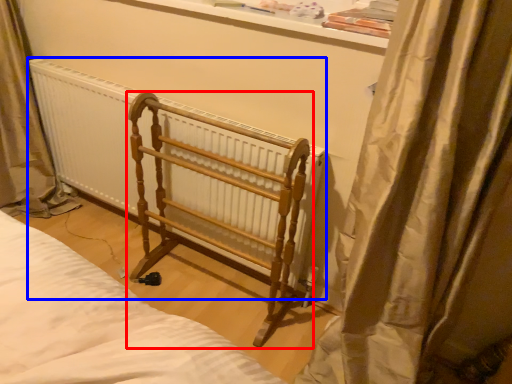
Question: Which object appears farthest to the camera in this image, furniture (highlighted by a red box) or radiator (highlighted by a blue box)?

Choices:
 (A) furniture
 (B) radiator

Answer: (B)